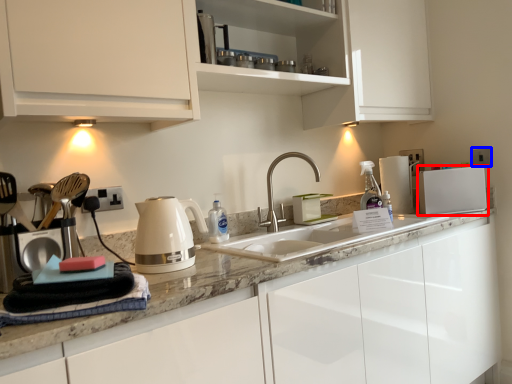
Question: Among these objects, which one is farthest to the camera, kitchen appliance (highlighted by a red box) or electric outlet (highlighted by a blue box)?

Choices:
 (A) kitchen appliance
 (B) electric outlet

Answer: (B)